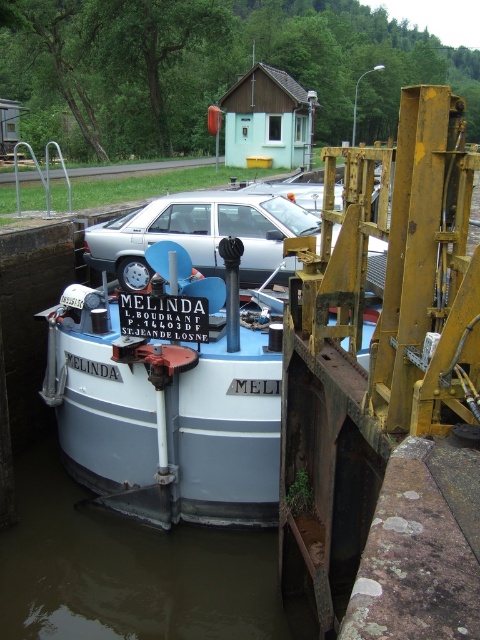
You are standing at the lock chamber and want to reach the point marked at coordinates (x=251, y=616). The lock chamber is 5 meters wide. Can you walk directly to that point without crossing the water?

The point at coordinates (x=251, y=616) is 6.47 meters away from the viewer. Since the lock chamber is only 5 meters wide, the point is likely beyond the chamber and into the water, so you cannot walk directly to it without crossing the water.

You are a boat operator trying to navigate the boat named MELINDA through the canal lock. You notice a specific point marked at coordinates [166,412]. Where exactly is this point located?

The point at coordinates [166,412] is on the white matte boat at center.

You are a boat operator checking the clearance for the white matte boat at center. The brown murky water at lower center is part of the canal. Can the boat pass under a bridge that is exactly at the water level height?

The white matte boat at center is taller than the brown murky water at lower center. Since the bridge is at water level, the boat cannot pass under the bridge without hitting it.